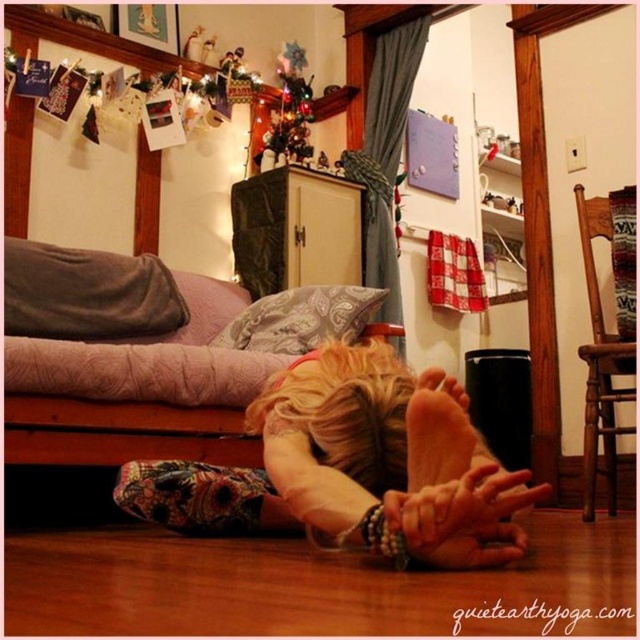
Based on the photo, which is below, velvety gray pillow at upper left or paisley-patterned fabric pillow at lower center?

paisley-patterned fabric pillow at lower center is lower down.

Is velvety gray pillow at upper left closer to the viewer compared to paisley-patterned fabric pillow at lower center?

Yes, velvety gray pillow at upper left is in front of paisley-patterned fabric pillow at lower center.

In order to click on velvety gray pillow at upper left in this screenshot , I will do `click(86, 292)`.

Looking at this image, does blonde hair at lower center appear on the left side of paisley-patterned fabric pillow at lower center?

No, blonde hair at lower center is not to the left of paisley-patterned fabric pillow at lower center.

Can you confirm if blonde hair at lower center is taller than paisley-patterned fabric pillow at lower center?

Yes, blonde hair at lower center is taller than paisley-patterned fabric pillow at lower center.

Does point (305, 369) come farther from viewer compared to point (371, 321)?

No.

Locate an element on the screen. blonde hair at lower center is located at coordinates (352, 467).

Does blonde hair at lower center appear under velvety gray pillow at upper left?

Indeed, blonde hair at lower center is positioned under velvety gray pillow at upper left.

Which is in front, point (372, 513) or point (70, 285)?

Point (372, 513)

Where is `blonde hair at lower center`? The width and height of the screenshot is (640, 640). blonde hair at lower center is located at coordinates (352, 467).